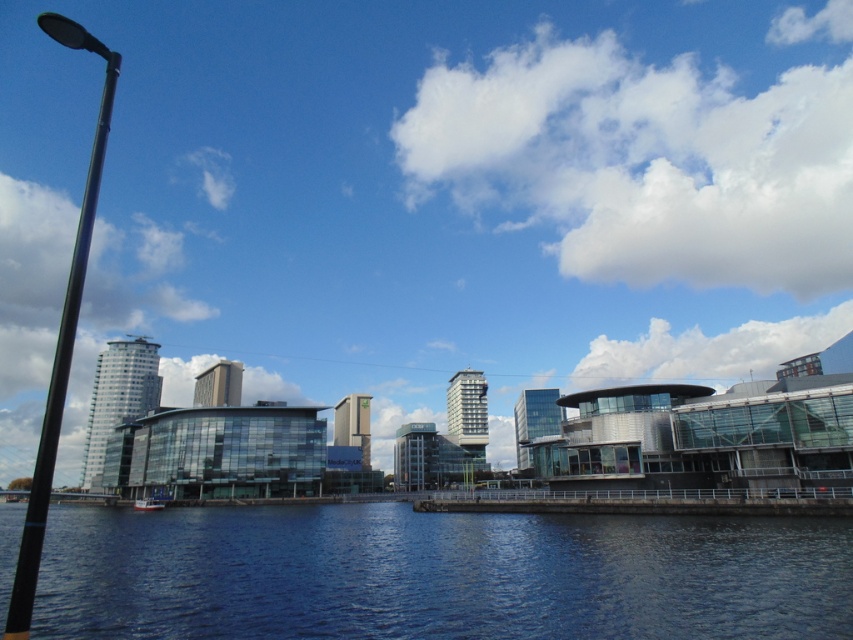
You are standing on the dock and see the blue glassy water at lower center and the white plastic boat at lower left. Which object is closer to you?

The white plastic boat at lower left is closer to you because the blue glassy water at lower center is located above it, meaning the boat is positioned beneath the water and thus nearer to your viewpoint on the dock.

From the picture: You are standing on the dock and want to take a photo of the black metal pole at left and the white plastic boat at lower left. Which object will appear larger in the photo?

The black metal pole at left will appear larger in the photo because it is much taller than the white plastic boat at lower left.

You are standing at the waterfront and want to reach the point marked at coordinates point (485, 605). Given that the point is 21.19 meters away from you, can you estimate how far you need to walk to reach it?

The point (485, 605) is 21.19 meters from the viewer, so you need to walk approximately 21.19 meters to reach it.